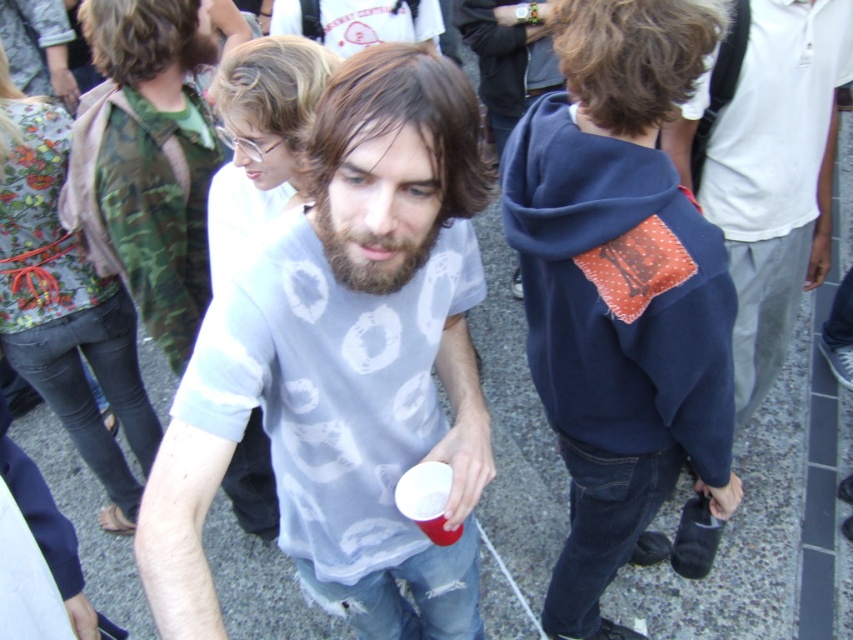
Based on the description provided, which object has a greater height between curly brown hair at upper left and beardsoft hairat center?

The curly brown hair at upper left has a greater height compared to the beardsoft hairat center.